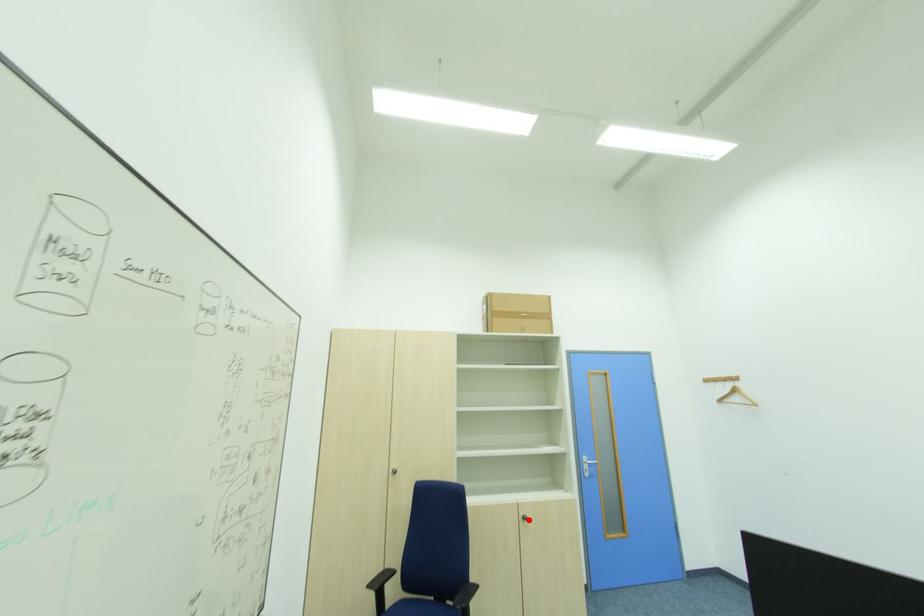
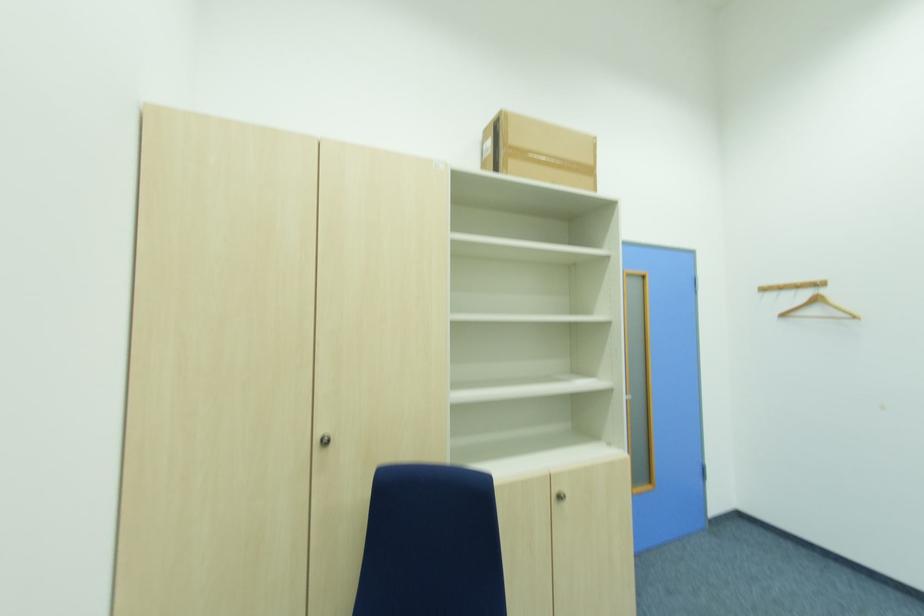
The point at the highlighted location is marked in the first image. Where is the corresponding point in the second image?

(564, 499)